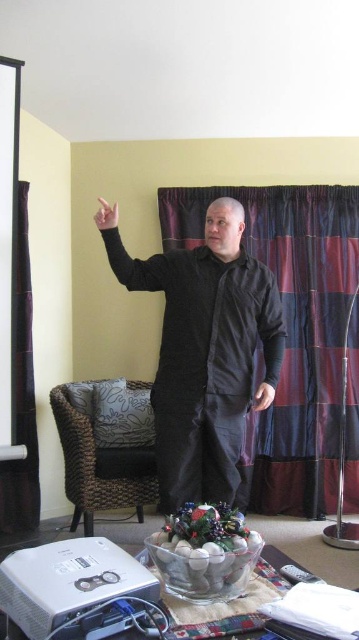
You are a guest in this living room and want to sit down. There is a black cotton robe at center and a velvet curtain at left. Which object is closer to the floor?

The black cotton robe at center is closer to the floor because it is below the velvet curtain at left.

You are a drone operator trying to navigate a small drone through the living room. Your drone is currently at point (110, 227). You need to fly it to point (355, 248). Is the destination point behind the drone from your current position?

Yes, the destination point (355, 248) is behind the drone at point (110, 227) since the description states that point (355, 248) is behind point (110, 227).

You are a delivery person trying to deliver a package to the living room. You see the woven rattan armchair at lower left and the black matte arm at upper left. Which object is closer to the entrance of the room?

The woven rattan armchair at lower left is closer to the entrance because the black matte arm at upper left is behind it, meaning the chair is in front and nearer to the entrance.